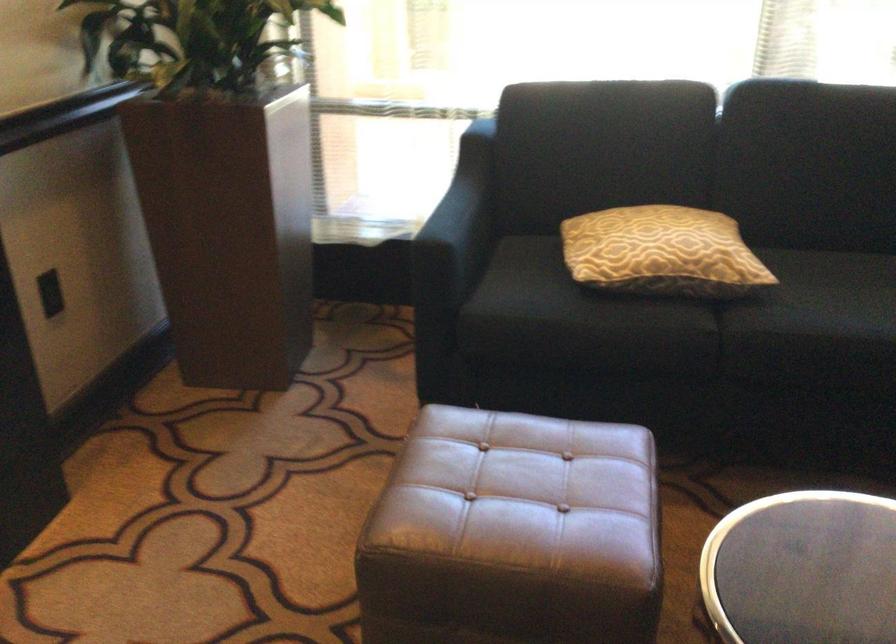
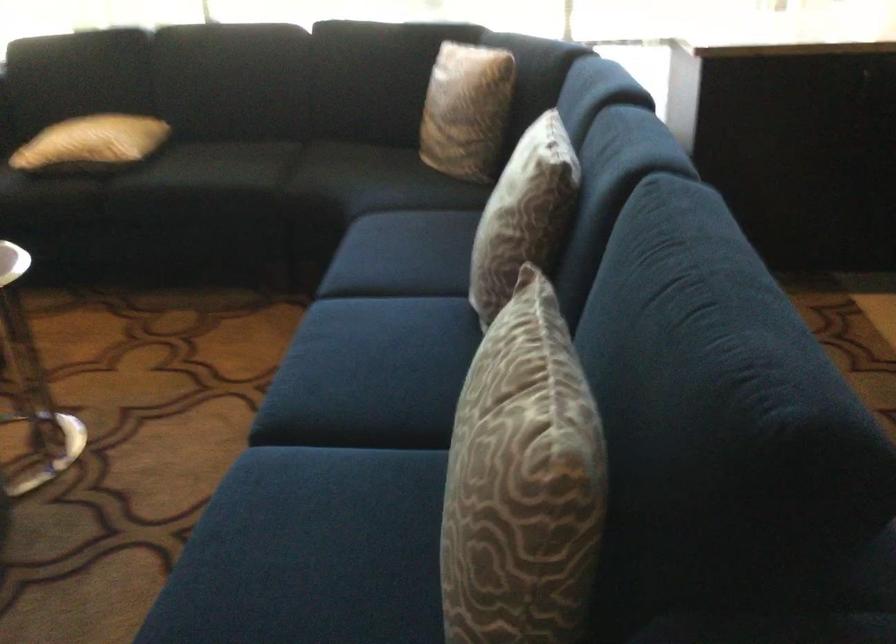
The images are taken continuously from a first-person perspective. In which direction are you moving?

The movement direction of the cameraman is right, backward.